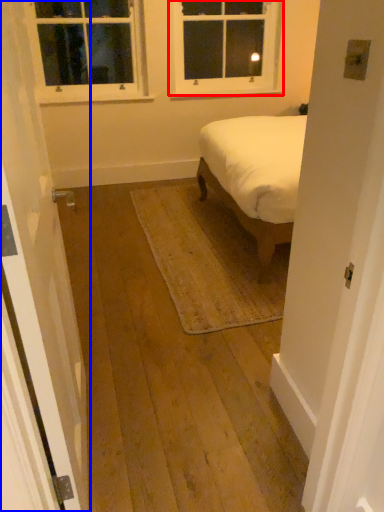
Question: Among these objects, which one is nearest to the camera, window (highlighted by a red box) or door (highlighted by a blue box)?

Choices:
 (A) window
 (B) door

Answer: (B)